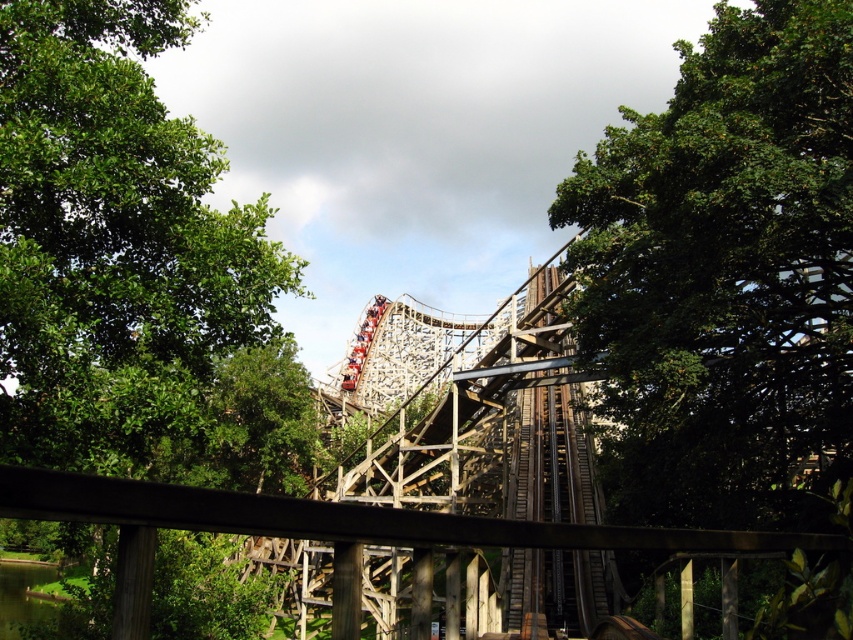
You are standing at the platform where the photo was taken. You see a green leafy tree at center and a green leafy tree at left. Which tree is positioned more to the left side of the scene?

The green leafy tree at left is positioned more to the left side of the scene compared to the green leafy tree at center.

In the scene shown: You are standing at the platform near the wooden roller coaster. You see two points marked on the roller coaster tracks. Which point is closer to you, point (653, 365) or point (260, 339)?

Point (653, 365) is closer to the viewer than point (260, 339).

You are standing on the platform near the wooden roller coaster and see the green leafy tree at center and the green leafy tree at left. Which tree is closer to you?

The green leafy tree at center is smaller than the green leafy tree at left, so the green leafy tree at left is closer to you.